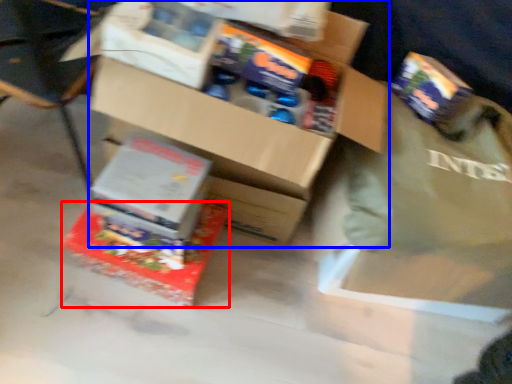
Question: Among these objects, which one is nearest to the camera, box (highlighted by a red box) or box (highlighted by a blue box)?

Choices:
 (A) box
 (B) box

Answer: (B)